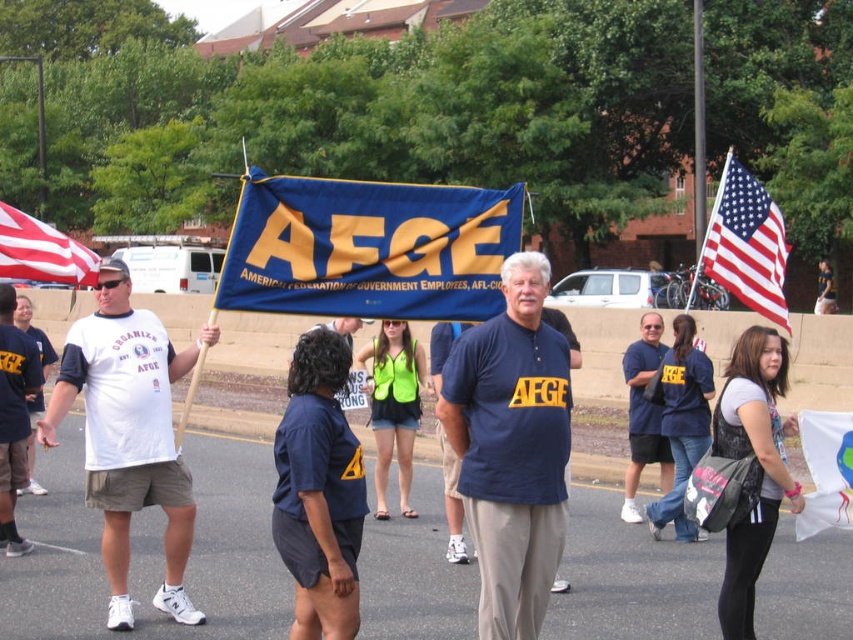
Does navy blue uniform at center appear over white fabric flag at lower right?

Indeed, navy blue uniform at center is positioned over white fabric flag at lower right.

In the scene shown: Who is more forward, (291, 518) or (816, 412)?

Positioned in front is point (291, 518).

Which is in front, point (320, 387) or point (833, 515)?

Point (320, 387)

At what (x,y) coordinates should I click in order to perform the action: click on navy blue uniform at center. Please return your answer as a coordinate pair (x, y). Looking at the image, I should click on (318, 490).

Is matte black shirt at center below blue cotton shirt at center?

Incorrect, matte black shirt at center is not positioned below blue cotton shirt at center.

Can you confirm if matte black shirt at center is shorter than blue cotton shirt at center?

Yes.

What do you see at coordinates (752, 467) in the screenshot?
I see `matte black shirt at center` at bounding box center [752, 467].

At what (x,y) coordinates should I click in order to perform the action: click on matte black shirt at center. Please return your answer as a coordinate pair (x, y). This screenshot has width=853, height=640. Looking at the image, I should click on (752, 467).

Which is behind, point (537, 605) or point (381, 502)?

Point (381, 502)

Find the location of `navy blue polo shirt at center`. navy blue polo shirt at center is located at coordinates (511, 449).